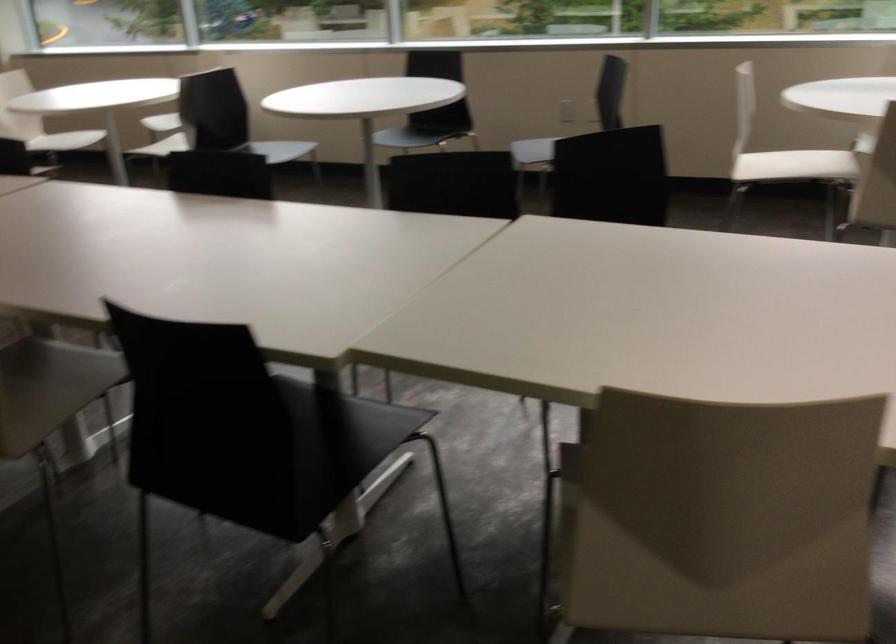
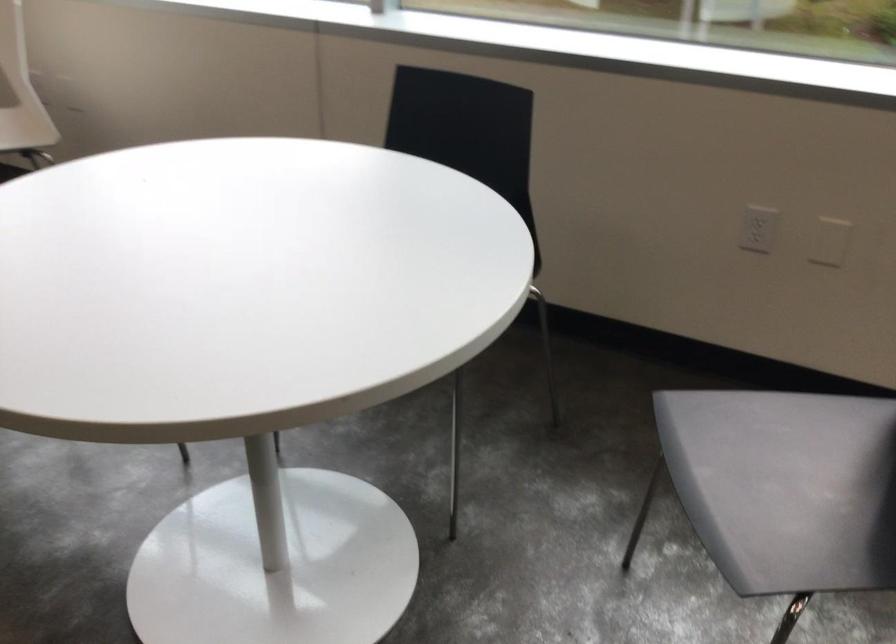
Question: The images are taken continuously from a first-person perspective. In which direction are you moving?

Choices:
 (A) Left
 (B) Right
 (C) Forward
 (D) Backward

Answer: (C)